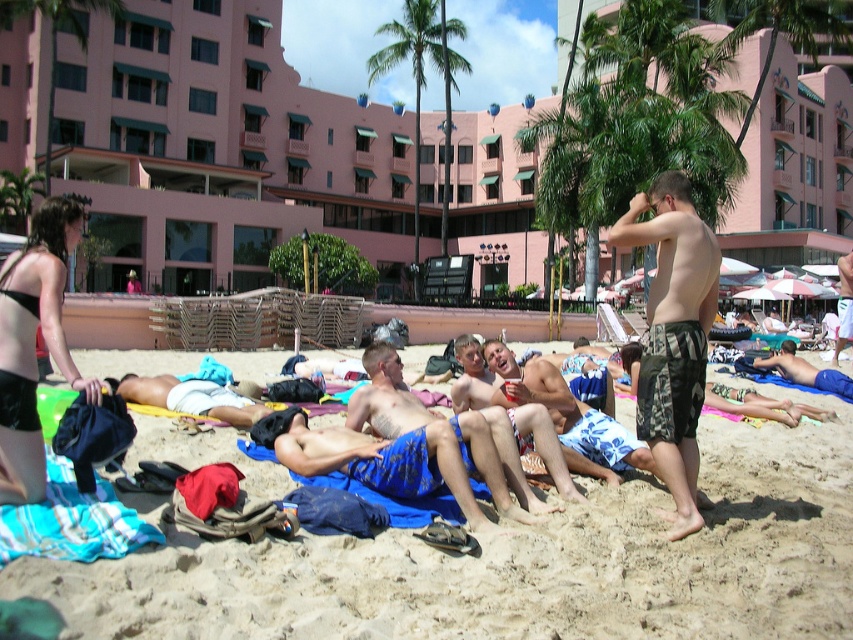
Question: Which point is farther from the camera taking this photo?

Choices:
 (A) (518, 404)
 (B) (167, 60)

Answer: (B)

Question: Does green leafy palm tree at center have a larger size compared to white cotton shorts at center?

Choices:
 (A) no
 (B) yes

Answer: (B)

Question: Is pink concrete building at center further to camera compared to blue textured shorts at center?

Choices:
 (A) yes
 (B) no

Answer: (A)

Question: Is pink concrete building at center smaller than blue patterned shorts at center?

Choices:
 (A) yes
 (B) no

Answer: (B)

Question: Which point is closer to the camera taking this photo?

Choices:
 (A) (498, 561)
 (B) (538, 234)
 (C) (540, 436)

Answer: (A)

Question: Which of the following is the closest to the observer?

Choices:
 (A) (288, 113)
 (B) (511, 508)

Answer: (B)